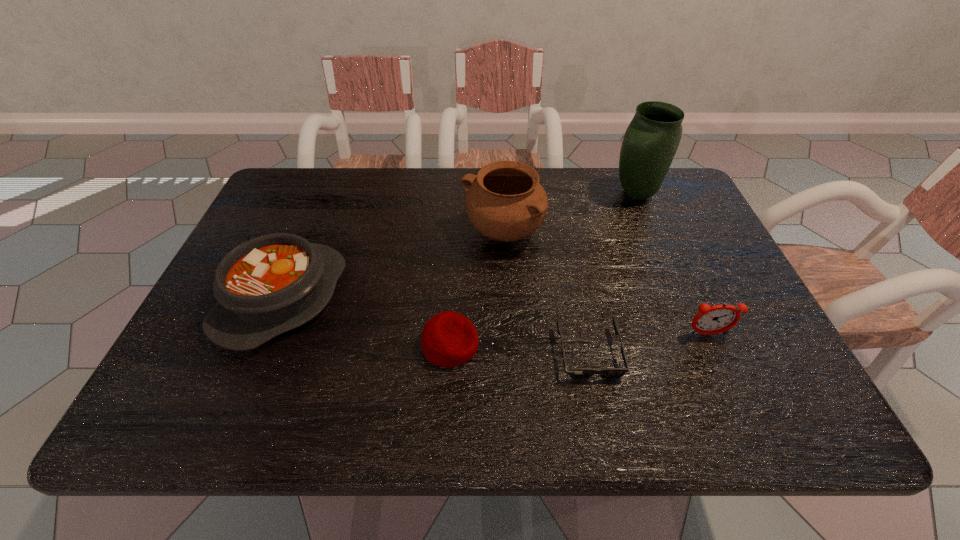
Where is `free area in between the second shortest object and the alarm clock`? The height and width of the screenshot is (540, 960). free area in between the second shortest object and the alarm clock is located at coordinates (579, 340).

Locate an element on the screen. free point between the shortest object and the fifth tallest object is located at coordinates (519, 349).

Image resolution: width=960 pixels, height=540 pixels. What are the coordinates of `vacant point located between the vase and the alarm clock` in the screenshot? It's located at (672, 264).

This screenshot has height=540, width=960. In order to click on free spot between the tallest object and the alarm clock in this screenshot , I will do `click(672, 264)`.

I want to click on blank region between the pottery and the tallest object, so click(x=569, y=213).

You are a GUI agent. You are given a task and a screenshot of the screen. Output one action in this format:
    pyautogui.click(x=<x>, y=<y>)
    Task: Click on the object that is the fifth closest one to the tallest object
    The width and height of the screenshot is (960, 540).
    Given the screenshot: What is the action you would take?
    pyautogui.click(x=268, y=285)

Choose which object is the nearest neighbor to the leftmost object. Please provide its 2D coordinates. Your answer should be formatted as a tuple, i.e. [(x, y)], where the tuple contains the x and y coordinates of a point satisfying the conditions above.

[(449, 339)]